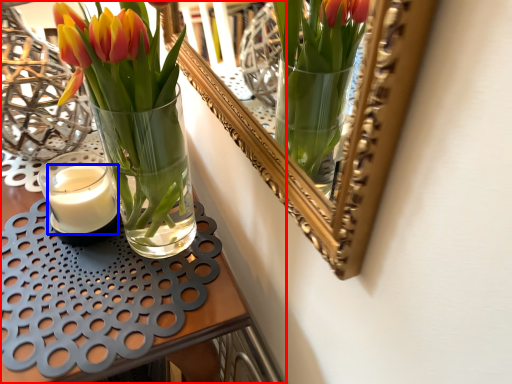
Question: Which point is further to the camera, table (highlighted by a red box) or candle (highlighted by a blue box)?

Choices:
 (A) table
 (B) candle

Answer: (B)